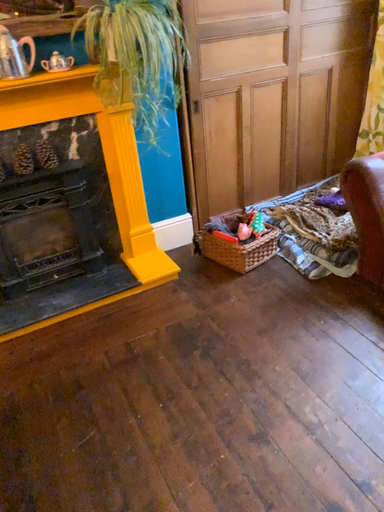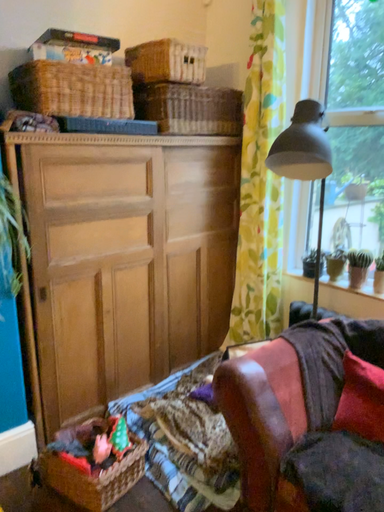
Question: How did the camera likely rotate when shooting the video?

Choices:
 (A) rotated left
 (B) rotated right

Answer: (B)